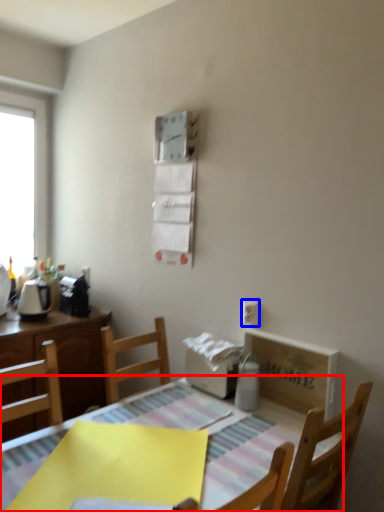
Question: Among these objects, which one is nearest to the camera, table (highlighted by a red box) or electric outlet (highlighted by a blue box)?

Choices:
 (A) table
 (B) electric outlet

Answer: (A)